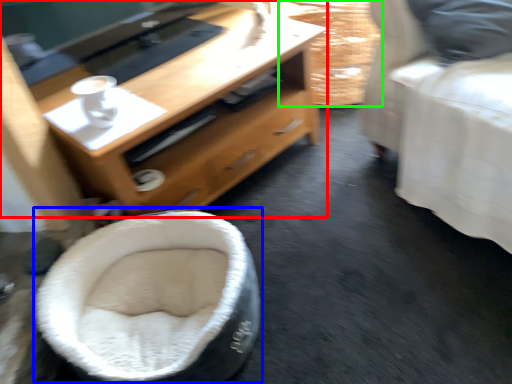
Question: Based on their relative distances, which object is nearer to desk (highlighted by a red box)? Choose from bean bag chair (highlighted by a blue box) and basket (highlighted by a green box).

Choices:
 (A) bean bag chair
 (B) basket

Answer: (A)